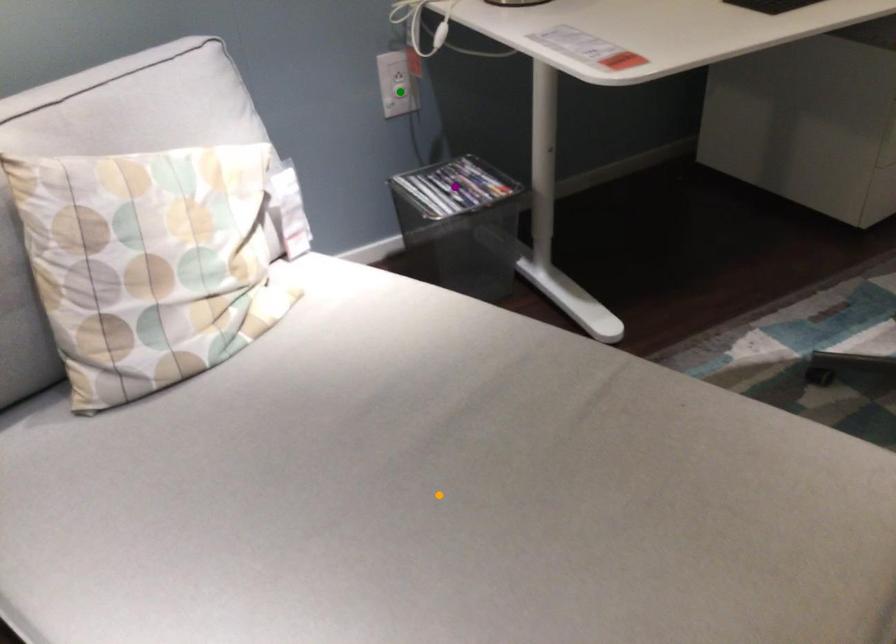
Order these from farthest to nearest:
A) orange point
B) purple point
C) green point

green point, purple point, orange point